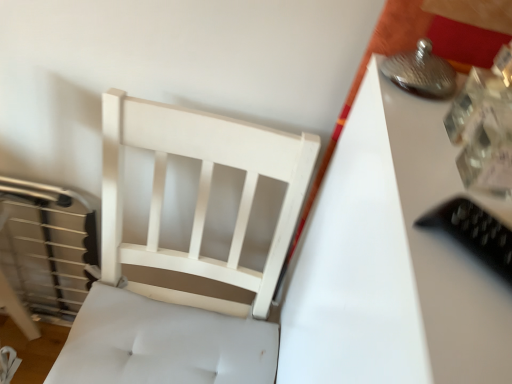
The width and height of the screenshot is (512, 384). I want to click on white glossy table at upper right, so 391,261.

Describe the element at coordinates (474, 232) in the screenshot. I see `black plastic remote at right` at that location.

This screenshot has width=512, height=384. Identify the location of white glossy table at upper right. (391, 261).

From a real-world perspective, is white glossy table at upper right physically located above or below white wood chair at left?

Clearly, from a real-world perspective, white glossy table at upper right is above white wood chair at left.

Does white glossy table at upper right have a smaller size compared to white wood chair at left?

No.

Is white glossy table at upper right positioned beyond the bounds of white wood chair at left?

Yes, white glossy table at upper right is outside of white wood chair at left.

Is white glossy table at upper right placed right next to white wood chair at left?

No, white glossy table at upper right is not making contact with white wood chair at left.

Looking at this image, is black plastic remote at right facing away from white wood chair at left?

That's not correct — black plastic remote at right is not looking away from white wood chair at left.

From the image's perspective, which is below, black plastic remote at right or white wood chair at left?

white wood chair at left appears lower in the image.

Can you tell me how much black plastic remote at right and white wood chair at left differ in facing direction?

The angular difference between black plastic remote at right and white wood chair at left is 41.2 degrees.

From a real-world perspective, which is physically below, black plastic remote at right or white wood chair at left?

white wood chair at left, from a real-world perspective.

In the scene shown: Between black plastic remote at right and white glossy table at upper right, which one has more height?

Standing taller between the two is white glossy table at upper right.

From a real-world perspective, is black plastic remote at right physically below white glossy table at upper right?

No, from a real-world perspective, black plastic remote at right is not under white glossy table at upper right.

In terms of size, does black plastic remote at right appear bigger or smaller than white glossy table at upper right?

Clearly, black plastic remote at right is smaller in size than white glossy table at upper right.

From the image's perspective, which one is positioned higher, white wood chair at left or white glossy table at upper right?

white wood chair at left appears higher in the image.

From a real-world perspective, which is physically below, white wood chair at left or white glossy table at upper right?

white wood chair at left.

Would you say white wood chair at left contains white glossy table at upper right?

No, white glossy table at upper right is not surrounded by white wood chair at left.

From the image's perspective, does white glossy table at upper right appear higher than black plastic remote at right?

No, from the image's perspective, white glossy table at upper right is not on top of black plastic remote at right.

Measure the distance from white glossy table at upper right to black plastic remote at right.

6.01 inches.

Is white glossy table at upper right turned away from black plastic remote at right?

No, black plastic remote at right is not at the back of white glossy table at upper right.

Is white glossy table at upper right inside or outside of black plastic remote at right?

white glossy table at upper right is spatially situated outside black plastic remote at right.

From the picture: Between white wood chair at left and black plastic remote at right, which one has smaller width?

black plastic remote at right.

Is white wood chair at left located outside black plastic remote at right?

Yes, white wood chair at left is located beyond the bounds of black plastic remote at right.

From a real-world perspective, is white wood chair at left beneath black plastic remote at right?

Indeed, from a real-world perspective, white wood chair at left is positioned beneath black plastic remote at right.

This screenshot has height=384, width=512. Identify the location of furniture below the black plastic remote at right (from a real-world perspective). (184, 257).

Identify the location of furniture that is above the white glossy table at upper right (from the image's perspective). The width and height of the screenshot is (512, 384). (184, 257).

This screenshot has height=384, width=512. What are the coordinates of `equipment in front of the white wood chair at left` in the screenshot? It's located at (474, 232).

Which object lies further to the anchor point white glossy table at upper right, black plastic remote at right or white wood chair at left?

white wood chair at left is positioned further to the anchor white glossy table at upper right.

Looking at the image, which one is located closer to black plastic remote at right, white wood chair at left or white glossy table at upper right?

white glossy table at upper right.

Which object lies nearer to the anchor point white glossy table at upper right, white wood chair at left or black plastic remote at right?

black plastic remote at right.

Looking at this image, when comparing their distances from white wood chair at left, does white glossy table at upper right or black plastic remote at right seem further?

black plastic remote at right is further to white wood chair at left.

Based on their spatial positions, is black plastic remote at right or white glossy table at upper right further from white wood chair at left?

black plastic remote at right is positioned further to the anchor white wood chair at left.

Considering their positions, is white glossy table at upper right positioned closer to black plastic remote at right than white wood chair at left?

Among the two, white glossy table at upper right is located nearer to black plastic remote at right.

Where is `equipment situated between white wood chair at left and white glossy table at upper right from left to right`? Image resolution: width=512 pixels, height=384 pixels. equipment situated between white wood chair at left and white glossy table at upper right from left to right is located at coordinates (474, 232).